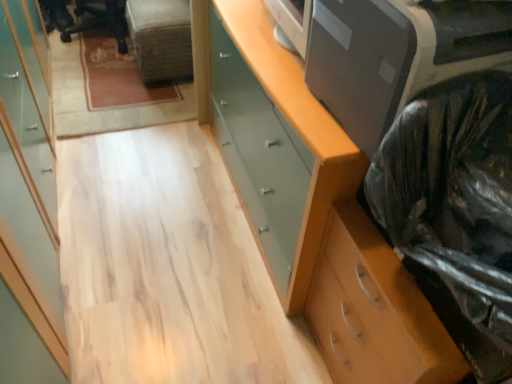
Question: Considering the relative sizes of satin gray printer at upper right and light wood cabinet at left in the image provided, is satin gray printer at upper right taller than light wood cabinet at left?

Choices:
 (A) yes
 (B) no

Answer: (B)

Question: From the image's perspective, is satin gray printer at upper right under light wood cabinet at left?

Choices:
 (A) no
 (B) yes

Answer: (B)

Question: Does satin gray printer at upper right have a greater width compared to light wood cabinet at left?

Choices:
 (A) no
 (B) yes

Answer: (B)

Question: Considering the relative positions of satin gray printer at upper right and light wood cabinet at left in the image provided, is satin gray printer at upper right behind light wood cabinet at left?

Choices:
 (A) no
 (B) yes

Answer: (B)

Question: From a real-world perspective, is satin gray printer at upper right under light wood cabinet at left?

Choices:
 (A) no
 (B) yes

Answer: (A)

Question: Is satin gray printer at upper right not close to light wood cabinet at left?

Choices:
 (A) no
 (B) yes

Answer: (A)

Question: Is wooden chest of drawers at right, which is the 1th chest of drawers from bottom to top, completely or partially outside of light wood cabinet at left?

Choices:
 (A) no
 (B) yes

Answer: (B)

Question: From the image's perspective, is wooden chest of drawers at right, which is the second chest of drawers in top-to-bottom order, located above light wood cabinet at left?

Choices:
 (A) no
 (B) yes

Answer: (A)

Question: Is wooden chest of drawers at right, which is the second chest of drawers in top-to-bottom order, looking in the opposite direction of light wood cabinet at left?

Choices:
 (A) no
 (B) yes

Answer: (A)

Question: Is wooden chest of drawers at right, which is the second chest of drawers in top-to-bottom order, in front of light wood cabinet at left?

Choices:
 (A) yes
 (B) no

Answer: (B)

Question: Is wooden chest of drawers at right, which is the 1th chest of drawers from bottom to top, next to light wood cabinet at left?

Choices:
 (A) no
 (B) yes

Answer: (A)

Question: Considering the relative sizes of wooden chest of drawers at right, which is the second chest of drawers in top-to-bottom order, and light wood cabinet at left in the image provided, is wooden chest of drawers at right, which is the second chest of drawers in top-to-bottom order, shorter than light wood cabinet at left?

Choices:
 (A) yes
 (B) no

Answer: (A)

Question: Is black plastic bag at right looking in the opposite direction of wooden chest of drawers at right, which is the 1th chest of drawers from bottom to top?

Choices:
 (A) yes
 (B) no

Answer: (B)